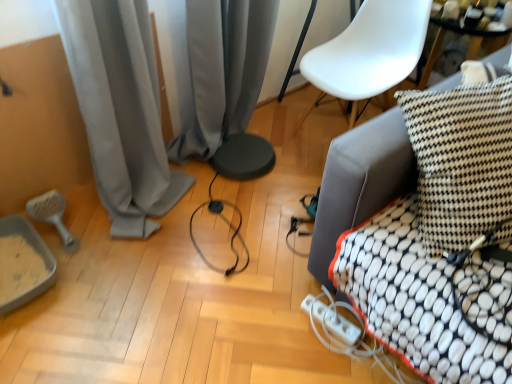
Question: Is gray fabric curtain at lower left, marked as the 1th curtain in a left-to-right arrangement, facing towards gray matte brush at lower left?

Choices:
 (A) no
 (B) yes

Answer: (A)

Question: From the image's perspective, is gray fabric curtain at lower left, marked as the 1th curtain in a left-to-right arrangement, located beneath gray matte brush at lower left?

Choices:
 (A) yes
 (B) no

Answer: (B)

Question: Considering the relative sizes of gray fabric curtain at lower left, marked as the 1th curtain in a left-to-right arrangement, and gray matte brush at lower left in the image provided, is gray fabric curtain at lower left, marked as the 1th curtain in a left-to-right arrangement, shorter than gray matte brush at lower left?

Choices:
 (A) no
 (B) yes

Answer: (A)

Question: Does gray fabric curtain at lower left, which is the 2th curtain in right-to-left order, have a larger size compared to gray matte brush at lower left?

Choices:
 (A) yes
 (B) no

Answer: (A)

Question: Is gray fabric curtain at lower left, which is the 2th curtain in right-to-left order, outside of gray matte brush at lower left?

Choices:
 (A) yes
 (B) no

Answer: (A)

Question: Considering the relative positions of gray fabric curtain at lower left, marked as the 1th curtain in a left-to-right arrangement, and gray matte brush at lower left in the image provided, is gray fabric curtain at lower left, marked as the 1th curtain in a left-to-right arrangement, behind gray matte brush at lower left?

Choices:
 (A) no
 (B) yes

Answer: (A)

Question: Would you say black and white checkered pillow at right is outside gray fabric curtain at lower left, marked as the 1th curtain in a left-to-right arrangement?

Choices:
 (A) yes
 (B) no

Answer: (A)

Question: Considering the relative sizes of black and white checkered pillow at right and gray fabric curtain at lower left, which is the 2th curtain in right-to-left order, in the image provided, is black and white checkered pillow at right wider than gray fabric curtain at lower left, which is the 2th curtain in right-to-left order,?

Choices:
 (A) no
 (B) yes

Answer: (A)

Question: Considering the relative positions of black and white checkered pillow at right and gray fabric curtain at lower left, which is the 2th curtain in right-to-left order, in the image provided, is black and white checkered pillow at right behind gray fabric curtain at lower left, which is the 2th curtain in right-to-left order,?

Choices:
 (A) yes
 (B) no

Answer: (A)

Question: Is black and white checkered pillow at right positioned with its back to gray fabric curtain at lower left, which is the 2th curtain in right-to-left order?

Choices:
 (A) yes
 (B) no

Answer: (B)

Question: From the image's perspective, is black and white checkered pillow at right over gray fabric curtain at lower left, which is the 2th curtain in right-to-left order?

Choices:
 (A) no
 (B) yes

Answer: (A)

Question: Can you confirm if black and white checkered pillow at right is positioned to the right of gray fabric curtain at lower left, which is the 2th curtain in right-to-left order?

Choices:
 (A) yes
 (B) no

Answer: (A)

Question: From the image's perspective, is white plastic extension cord at lower center on top of white plastic armchair at upper right?

Choices:
 (A) yes
 (B) no

Answer: (B)